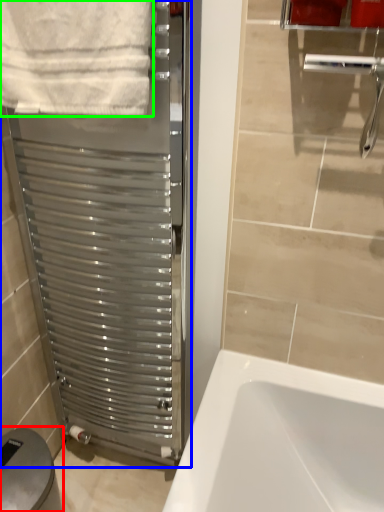
Question: Considering the real-world distances, which object is farthest from gray (highlighted by a red box)? screen door (highlighted by a blue box) or towel (highlighted by a green box)?

Choices:
 (A) screen door
 (B) towel

Answer: (B)